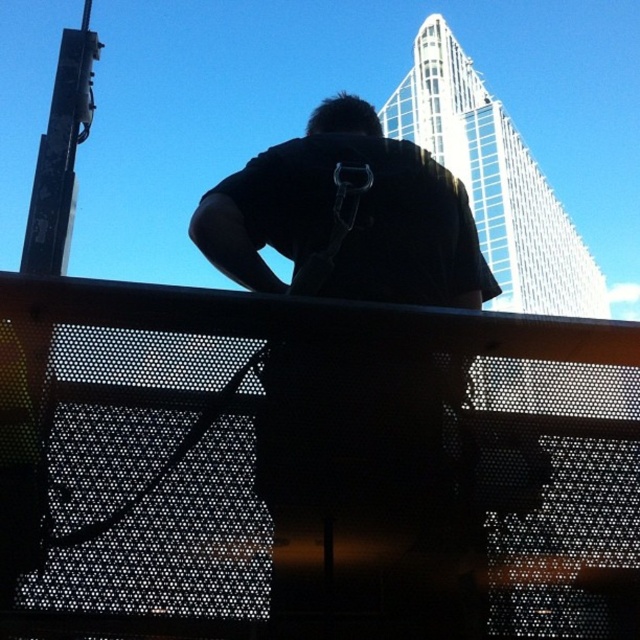
You are standing at the center of the image and want to touch the perforated metal fence at center. In which direction should you move to reach it?

The perforated metal fence at center is located at point (310, 467), so you should move to the right and slightly downward from the center to reach it.

What object is located at the coordinate point (310, 467) in the image?

The object located at the coordinate point (310, 467) is the perforated metal fence at center.

You are a photographer trying to capture the silhouette of the person against the skyscraper. The perforated metal fence at center and the black matte shirt at center are both in your view. Which object is closer to the camera?

The perforated metal fence at center is positioned under the black matte shirt at center, meaning the black matte shirt at center is closer to the camera.